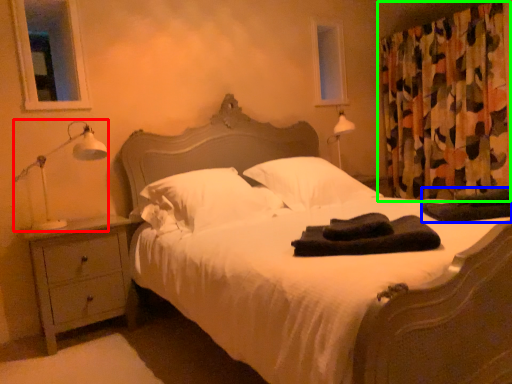
Question: Which is nearer to the table lamp (highlighted by a red box)? material (highlighted by a blue box) or curtain (highlighted by a green box).

Choices:
 (A) material
 (B) curtain

Answer: (A)